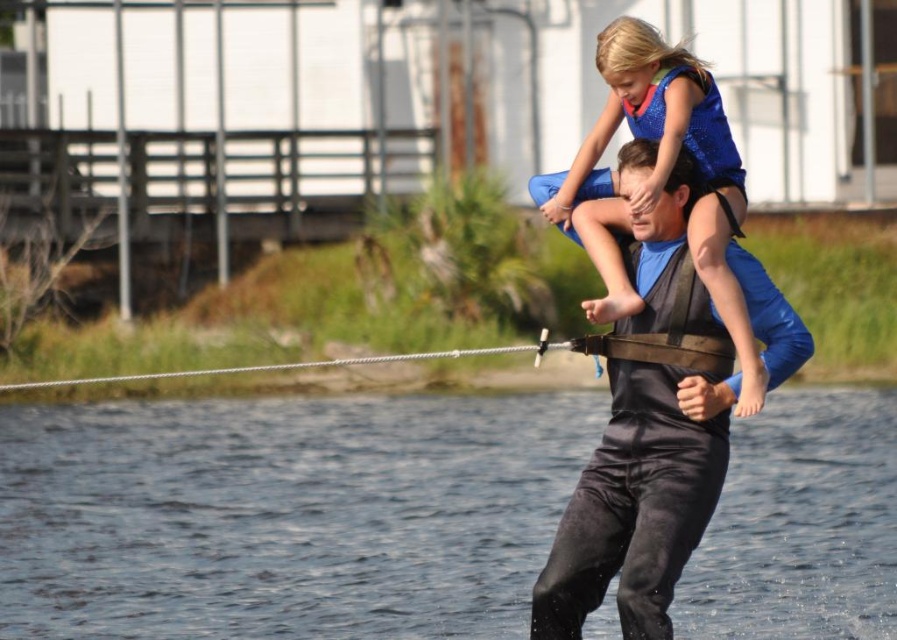
Is point (605, 432) more distant than point (607, 179)?

No, (605, 432) is closer to viewer.

Which is in front, point (532, 627) or point (652, 136)?

Point (532, 627)

Does point (721, 436) lie behind point (634, 124)?

No.

Locate an element on the screen. The height and width of the screenshot is (640, 897). black matte life vest at center is located at coordinates (642, 468).

Looking at this image, is clear water at center thinner than blue sparkly dress at upper center?

No, clear water at center is not thinner than blue sparkly dress at upper center.

Who is positioned more to the left, clear water at center or blue sparkly dress at upper center?

clear water at center is more to the left.

The width and height of the screenshot is (897, 640). What are the coordinates of `clear water at center` in the screenshot? It's located at (284, 515).

The image size is (897, 640). Identify the location of clear water at center. (284, 515).

Based on the photo, does clear water at center have a greater height compared to black matte life vest at center?

Incorrect, clear water at center's height is not larger of black matte life vest at center's.

Is point (24, 586) in front of point (634, 381)?

That is False.

Locate an element on the screen. clear water at center is located at coordinates (284, 515).

Where is `clear water at center`? The width and height of the screenshot is (897, 640). clear water at center is located at coordinates (284, 515).